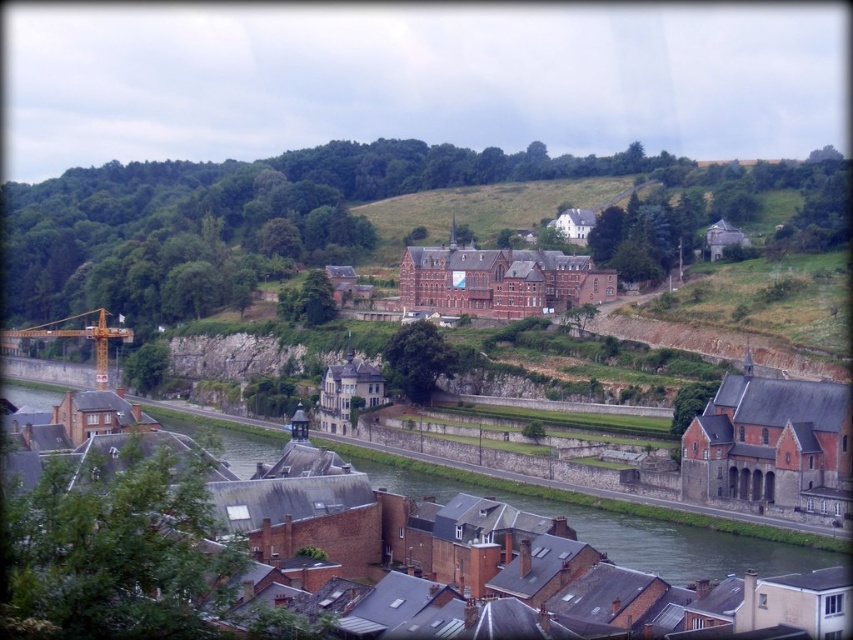
Question: Which point appears farthest from the camera in this image?

Choices:
 (A) (100, 362)
 (B) (640, 522)

Answer: (A)

Question: Which point is farther to the camera?

Choices:
 (A) yellow metallic crane at left
 (B) gray concrete river at lower center

Answer: (A)

Question: Can you confirm if gray concrete river at lower center is positioned to the right of yellow metallic crane at left?

Choices:
 (A) no
 (B) yes

Answer: (B)

Question: Does gray concrete river at lower center have a greater width compared to yellow metallic crane at left?

Choices:
 (A) yes
 (B) no

Answer: (A)

Question: Can you confirm if gray concrete river at lower center is bigger than yellow metallic crane at left?

Choices:
 (A) yes
 (B) no

Answer: (A)

Question: Which point is farther from the camera taking this photo?

Choices:
 (A) (274, 456)
 (B) (120, 332)

Answer: (B)